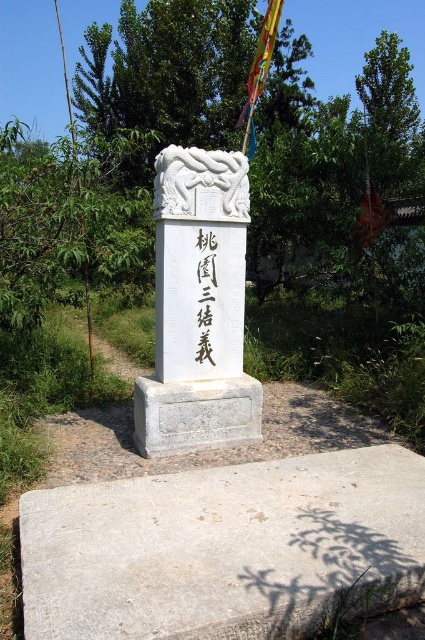
You are a construction worker tasked with placing a new rectangular plaque on the monument. The plaque must be placed either on the gray concrete at lower center or the black stone writing at center. Which surface can accommodate a plaque that is wider than the other object?

The gray concrete at lower center might be wider than black stone writing at center, so the plaque should be placed on the gray concrete at lower center to ensure it can accommodate a wider plaque.

You are a visitor at this monument and want to take a photo of the gray concrete at lower center and the black stone writing at center. Which object should you focus on first if you want to capture both in one shot without moving the camera?

You should focus on the black stone writing at center first because it is taller than the gray concrete at lower center, so adjusting the focus to the taller object ensures both are in frame.

You are a tourist visiting the monument and want to take a photo that includes both the gray stone base at center and the black stone writing at center. Based on their positions, where should you position yourself relative to the monument to ensure both are visible in the frame?

Since the gray stone base at center is located below the black stone writing at center, you should position yourself in front and at a slight upward angle to capture both the base and the writing in the frame.